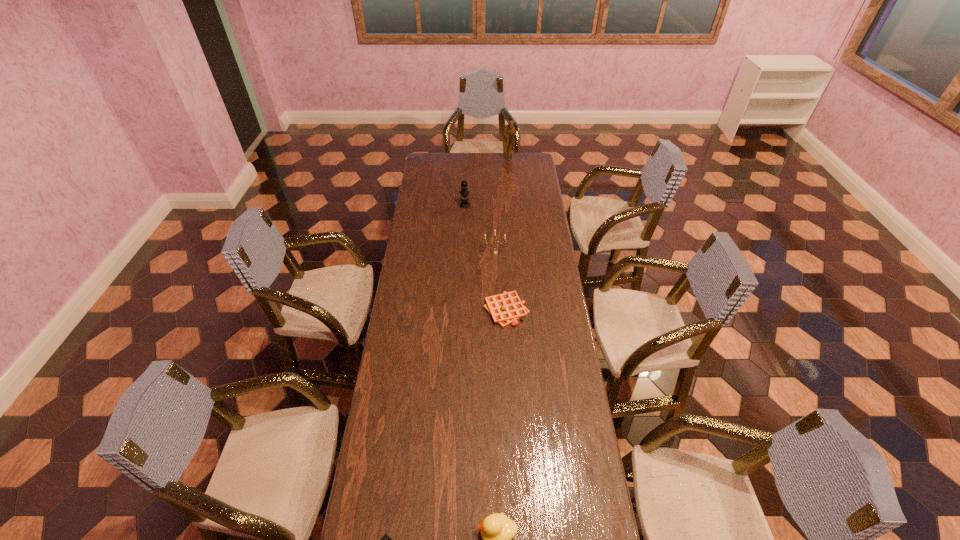
Find the location of `the farthest object`. the farthest object is located at coordinates (509, 132).

In order to click on figurine in this screenshot , I will do `click(509, 132)`.

The width and height of the screenshot is (960, 540). In order to click on the second object from left to right in this screenshot , I will do `click(464, 191)`.

The width and height of the screenshot is (960, 540). Identify the location of microphone. (464, 191).

At what (x,y) coordinates should I click in order to perform the action: click on candle. Please return your answer as a coordinate pair (x, y). This screenshot has height=540, width=960. Looking at the image, I should click on (494, 251).

Identify the location of the fifth tallest object. (506, 308).

Where is `waffle`? The height and width of the screenshot is (540, 960). waffle is located at coordinates (506, 308).

Where is `blank area located 0.320m on the front-facing side of the figurine`? blank area located 0.320m on the front-facing side of the figurine is located at coordinates (511, 190).

Identify the location of vacant space located 0.130m on the right of the microphone. Image resolution: width=960 pixels, height=540 pixels. (493, 205).

Find the location of a particular element. The image size is (960, 540). vacant space positioned on the front of the candle is located at coordinates (495, 280).